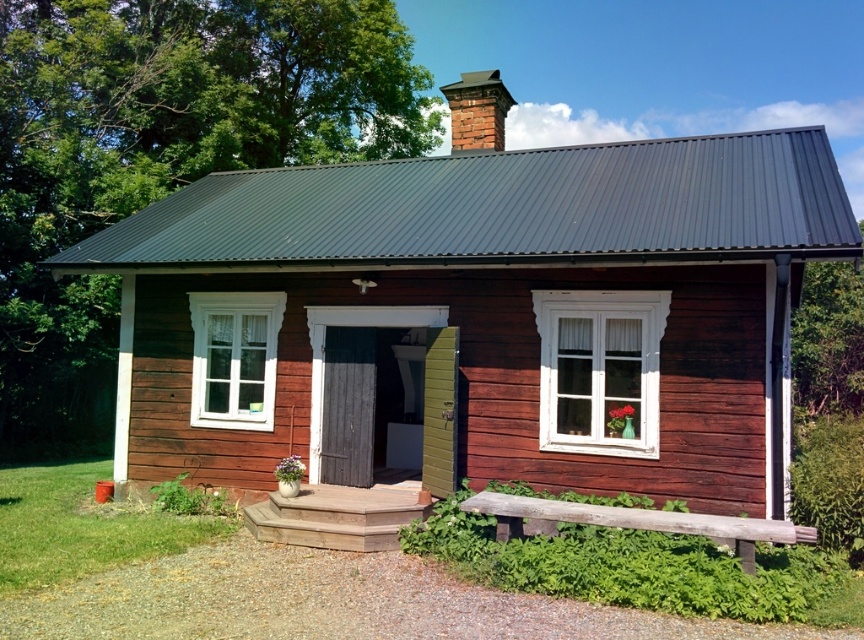
You are standing at the base of the wooden steps leading to the cabin door. You see two points marked in the image. Which point is closer to you, point (259, 477) or point (499, 128)?

Point (259, 477) is closer to you because it is in front of point (499, 128).

You are standing in front of the smooth wooden cottage at center and want to see the red brick chimney at upper center. Can you see it clearly from your current position?

The smooth wooden cottage at center is in front of the red brick chimney at upper center, so the cottage may block your view of the chimney.

Based on the photo, you are standing in front of the wooden cabin and want to know how far the point at coordinates (756, 348) is from your current position. Can you determine the distance?

The point at coordinates (756, 348) is 26.93 feet away from your current position.